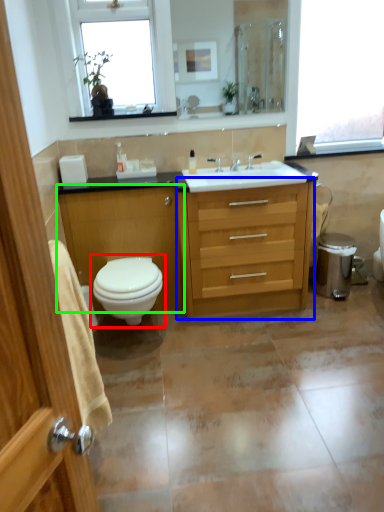
Question: Based on their relative distances, which object is nearer to toilet (highlighted by a red box)? Choose from chest of drawers (highlighted by a blue box) and cabinetry (highlighted by a green box).

Choices:
 (A) chest of drawers
 (B) cabinetry

Answer: (B)